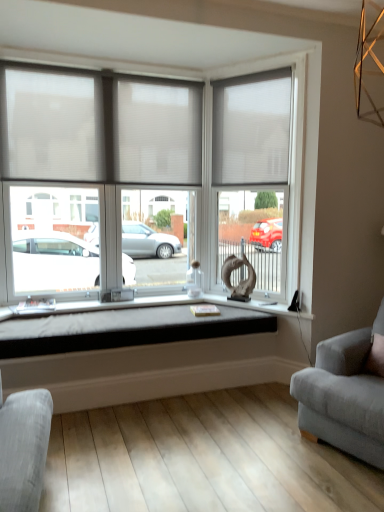
Identify the location of blank space situated above white sheer blinds at upper left, arranged as the second window blind when viewed from the right (from a real-world perspective). (94, 75).